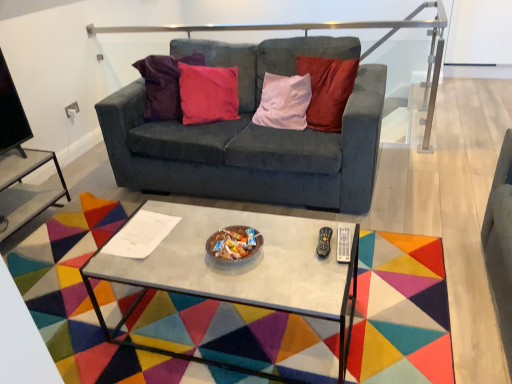
Question: Is satin silver rail at upper center far away from metallic gray coffee table at center?

Choices:
 (A) yes
 (B) no

Answer: (A)

Question: Can you confirm if satin silver rail at upper center is shorter than metallic gray coffee table at center?

Choices:
 (A) yes
 (B) no

Answer: (B)

Question: From a real-world perspective, is satin silver rail at upper center under metallic gray coffee table at center?

Choices:
 (A) yes
 (B) no

Answer: (B)

Question: From a real-world perspective, does satin silver rail at upper center stand above metallic gray coffee table at center?

Choices:
 (A) no
 (B) yes

Answer: (B)

Question: Considering the relative sizes of satin silver rail at upper center and metallic gray coffee table at center in the image provided, is satin silver rail at upper center taller than metallic gray coffee table at center?

Choices:
 (A) yes
 (B) no

Answer: (A)

Question: Based on their positions, is velvet dark gray couch at center located to the left or right of metallic silver side table at lower left?

Choices:
 (A) left
 (B) right

Answer: (B)

Question: From the image's perspective, is velvet dark gray couch at center located above or below metallic silver side table at lower left?

Choices:
 (A) above
 (B) below

Answer: (A)

Question: Is velvet dark gray couch at center taller or shorter than metallic silver side table at lower left?

Choices:
 (A) tall
 (B) short

Answer: (A)

Question: Is velvet dark gray couch at center inside or outside of metallic silver side table at lower left?

Choices:
 (A) outside
 (B) inside

Answer: (A)

Question: Is velvet dark gray couch at center in front of or behind metallic gray coffee table at center in the image?

Choices:
 (A) behind
 (B) front

Answer: (A)

Question: Is velvet dark gray couch at center to the left or to the right of metallic gray coffee table at center in the image?

Choices:
 (A) right
 (B) left

Answer: (A)

Question: From the image's perspective, is velvet dark gray couch at center above or below metallic gray coffee table at center?

Choices:
 (A) above
 (B) below

Answer: (A)

Question: Considering the positions of velvet dark gray couch at center and metallic gray coffee table at center in the image, is velvet dark gray couch at center wider or thinner than metallic gray coffee table at center?

Choices:
 (A) wide
 (B) thin

Answer: (A)

Question: Is satin silver rail at upper center in front of or behind metallic gray coffee table at center in the image?

Choices:
 (A) behind
 (B) front

Answer: (A)

Question: Is satin silver rail at upper center taller or shorter than metallic gray coffee table at center?

Choices:
 (A) tall
 (B) short

Answer: (A)